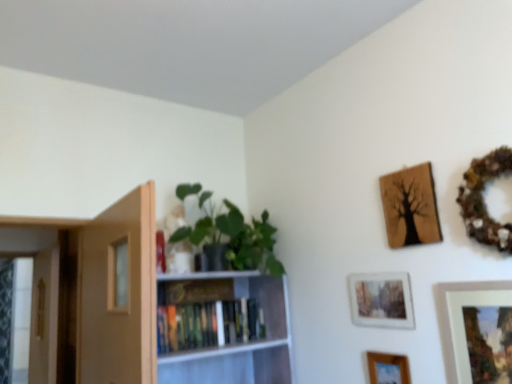
Question: Would you consider green matte plant at upper left to be distant from wooden textured picture frame at upper right, positioned as the fourth picture frame in bottom-to-top order?

Choices:
 (A) yes
 (B) no

Answer: (B)

Question: From the image's perspective, is green matte plant at upper left located above wooden textured picture frame at upper right, the 1th picture frame when ordered from top to bottom?

Choices:
 (A) yes
 (B) no

Answer: (B)

Question: Can you confirm if green matte plant at upper left is bigger than wooden textured picture frame at upper right, the 1th picture frame when ordered from top to bottom?

Choices:
 (A) no
 (B) yes

Answer: (B)

Question: Is the position of green matte plant at upper left less distant than that of wooden textured picture frame at upper right, positioned as the fourth picture frame in bottom-to-top order?

Choices:
 (A) no
 (B) yes

Answer: (A)

Question: Does green matte plant at upper left have a smaller size compared to wooden textured picture frame at upper right, the 1th picture frame when ordered from top to bottom?

Choices:
 (A) no
 (B) yes

Answer: (A)

Question: Is matte white picture frame at lower right, which is counted as the 3th picture frame, starting from the top, to the left or to the right of hardcover books at center in the image?

Choices:
 (A) left
 (B) right

Answer: (B)

Question: Is matte white picture frame at lower right, which is counted as the 3th picture frame, starting from the top, in front of or behind hardcover books at center in the image?

Choices:
 (A) behind
 (B) front

Answer: (B)

Question: Based on their sizes in the image, would you say matte white picture frame at lower right, which is counted as the 3th picture frame, starting from the top, is bigger or smaller than hardcover books at center?

Choices:
 (A) big
 (B) small

Answer: (B)

Question: Considering the positions of matte white picture frame at lower right, the 2th picture frame ordered from the bottom, and hardcover books at center in the image, is matte white picture frame at lower right, the 2th picture frame ordered from the bottom, wider or thinner than hardcover books at center?

Choices:
 (A) wide
 (B) thin

Answer: (B)

Question: In terms of size, does green matte plant at upper left appear bigger or smaller than light brown wood door at left?

Choices:
 (A) big
 (B) small

Answer: (A)

Question: Looking at their shapes, would you say green matte plant at upper left is wider or thinner than light brown wood door at left?

Choices:
 (A) thin
 (B) wide

Answer: (B)

Question: From a real-world perspective, is green matte plant at upper left above or below light brown wood door at left?

Choices:
 (A) below
 (B) above

Answer: (B)

Question: Relative to light brown wood door at left, is green matte plant at upper left in front or behind?

Choices:
 (A) behind
 (B) front

Answer: (A)

Question: Is green matte plant at upper left inside the boundaries of wooden textured picture frame at upper right, positioned as the fourth picture frame in bottom-to-top order, or outside?

Choices:
 (A) inside
 (B) outside

Answer: (B)

Question: Is green matte plant at upper left in front of or behind wooden textured picture frame at upper right, positioned as the fourth picture frame in bottom-to-top order, in the image?

Choices:
 (A) behind
 (B) front

Answer: (A)